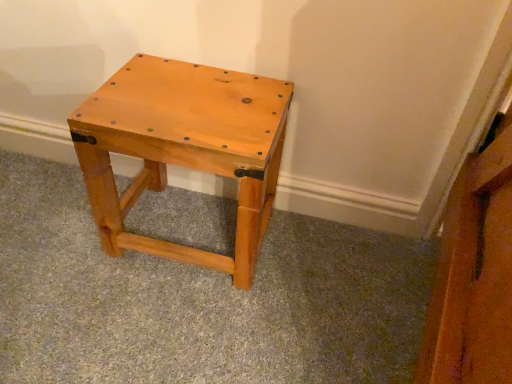
The width and height of the screenshot is (512, 384). In order to click on free point below natural wood stool at center (from a real-world perspective) in this screenshot , I will do `click(188, 215)`.